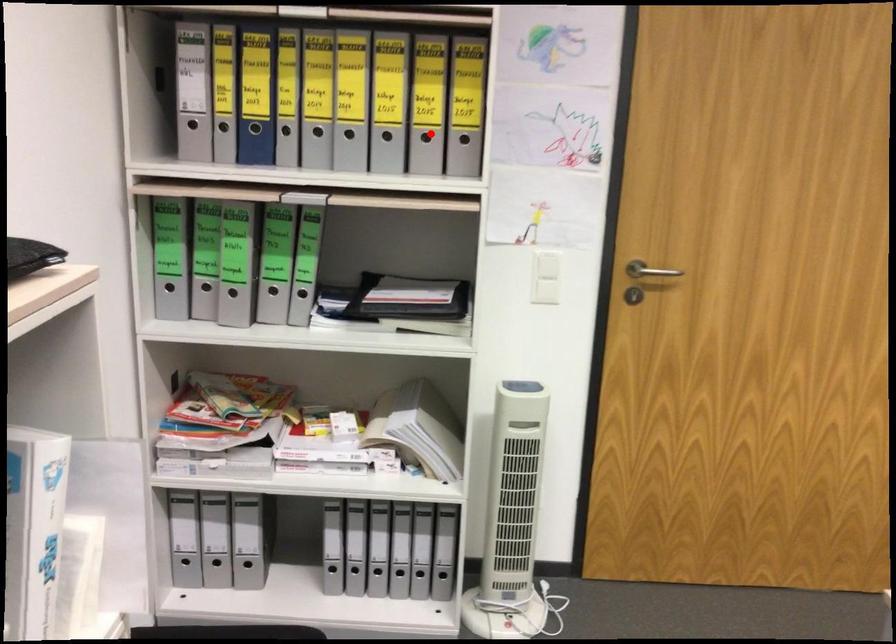
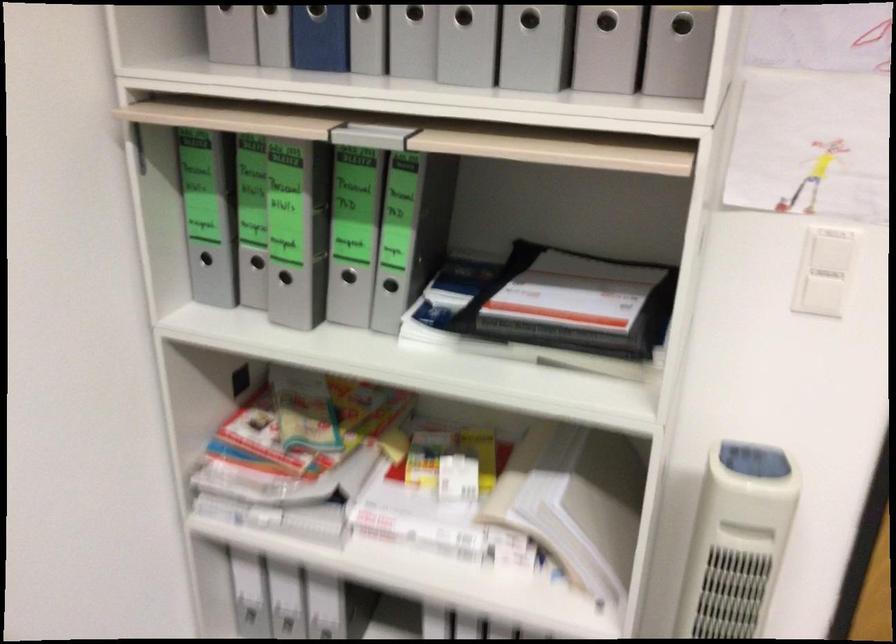
Where in the second image is the point corresponding to the highlighted location from the first image?

(606, 21)